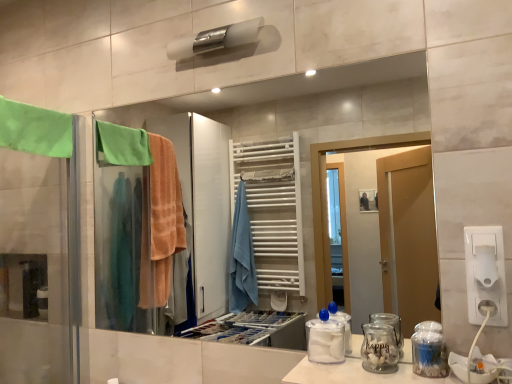
Question: Does transparent plastic container at center have a smaller size compared to clear plastic jar at lower right, the second glass jar positioned from the left?

Choices:
 (A) no
 (B) yes

Answer: (A)

Question: Is transparent plastic container at center turned away from clear plastic jar at lower right, positioned as the first glass jar in right-to-left order?

Choices:
 (A) no
 (B) yes

Answer: (A)

Question: Does transparent plastic container at center turn towards clear plastic jar at lower right, positioned as the first glass jar in right-to-left order?

Choices:
 (A) yes
 (B) no

Answer: (B)

Question: From the image's perspective, would you say transparent plastic container at center is shown under clear plastic jar at lower right, positioned as the first glass jar in right-to-left order?

Choices:
 (A) yes
 (B) no

Answer: (B)

Question: Is transparent plastic container at center to the right of clear plastic jar at lower right, the second glass jar positioned from the left, from the viewer's perspective?

Choices:
 (A) yes
 (B) no

Answer: (B)

Question: In terms of height, does clear plastic jar at lower right, positioned as the first glass jar in right-to-left order, look taller or shorter compared to transparent plastic container at center?

Choices:
 (A) tall
 (B) short

Answer: (B)

Question: From the image's perspective, is clear plastic jar at lower right, positioned as the first glass jar in right-to-left order, located above or below transparent plastic container at center?

Choices:
 (A) below
 (B) above

Answer: (A)

Question: Considering the positions of clear plastic jar at lower right, positioned as the first glass jar in right-to-left order, and transparent plastic container at center in the image, is clear plastic jar at lower right, positioned as the first glass jar in right-to-left order, bigger or smaller than transparent plastic container at center?

Choices:
 (A) big
 (B) small

Answer: (B)

Question: Is clear plastic jar at lower right, positioned as the first glass jar in right-to-left order, wider or thinner than transparent plastic container at center?

Choices:
 (A) thin
 (B) wide

Answer: (A)

Question: Considering the relative positions of white plastic socket at lower right and clear plastic jar at lower right, the second glass jar positioned from the left, in the image provided, is white plastic socket at lower right to the left or to the right of clear plastic jar at lower right, the second glass jar positioned from the left,?

Choices:
 (A) left
 (B) right

Answer: (B)

Question: From the image's perspective, is white plastic socket at lower right located above or below clear plastic jar at lower right, positioned as the first glass jar in right-to-left order?

Choices:
 (A) above
 (B) below

Answer: (A)

Question: Does point (480, 304) appear closer or farther from the camera than point (442, 365)?

Choices:
 (A) closer
 (B) farther

Answer: (B)

Question: Looking at the image, does white plastic socket at lower right seem bigger or smaller compared to clear plastic jar at lower right, positioned as the first glass jar in right-to-left order?

Choices:
 (A) small
 (B) big

Answer: (A)

Question: Choose the correct answer: Is white plastic toilet paper at right inside clear plastic jar at lower right, positioned as the first glass jar in right-to-left order, or outside it?

Choices:
 (A) inside
 (B) outside

Answer: (B)

Question: From the image's perspective, is white plastic toilet paper at right above or below clear plastic jar at lower right, positioned as the first glass jar in right-to-left order?

Choices:
 (A) below
 (B) above

Answer: (B)